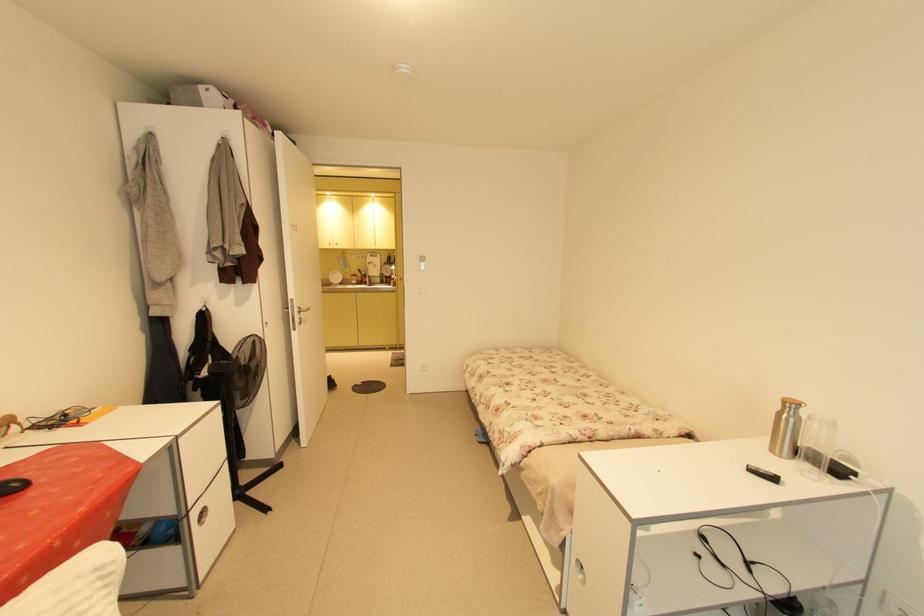
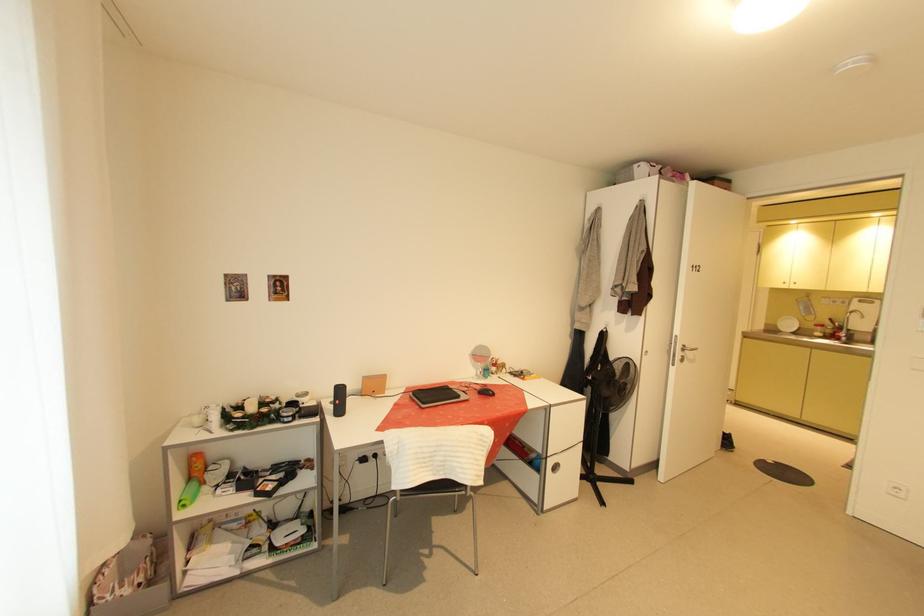
Question: The camera is either moving clockwise (left) or counter-clockwise (right) around the object. The first image is from the beginning of the video and the second image is from the end. Is the camera moving left or right when shooting the video?

Choices:
 (A) Left
 (B) Right

Answer: (B)